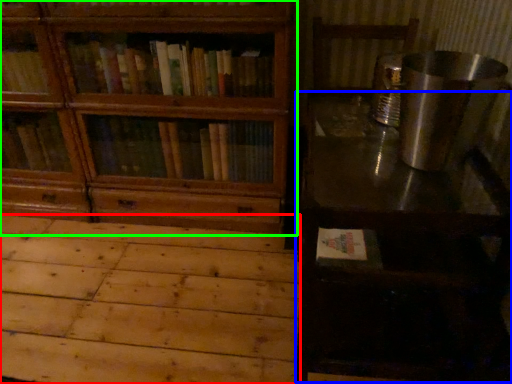
Question: Which object is the farthest from plywood (highlighted by a red box)? Choose among these: table (highlighted by a blue box) or bookcase (highlighted by a green box).

Choices:
 (A) table
 (B) bookcase

Answer: (A)